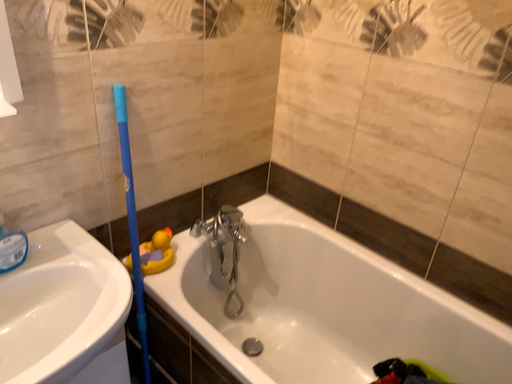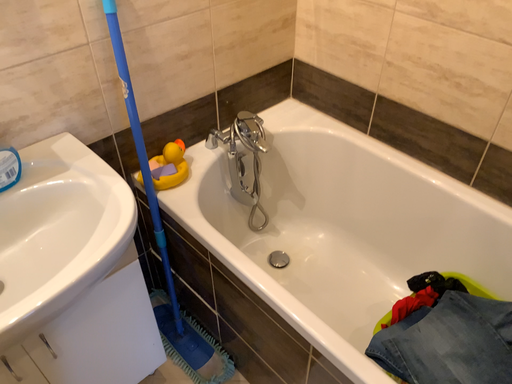
Question: How did the camera likely rotate when shooting the video?

Choices:
 (A) rotated upward
 (B) rotated downward

Answer: (B)